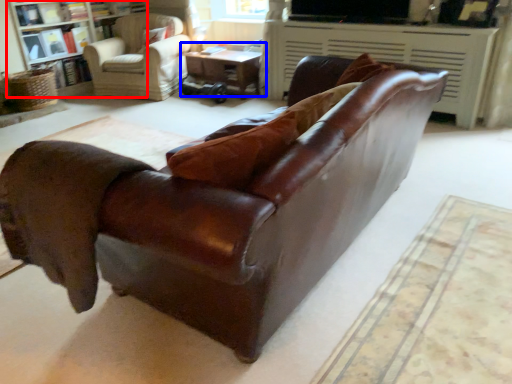
Question: Among these objects, which one is farthest to the camera, bookcase (highlighted by a red box) or table (highlighted by a blue box)?

Choices:
 (A) bookcase
 (B) table

Answer: (B)